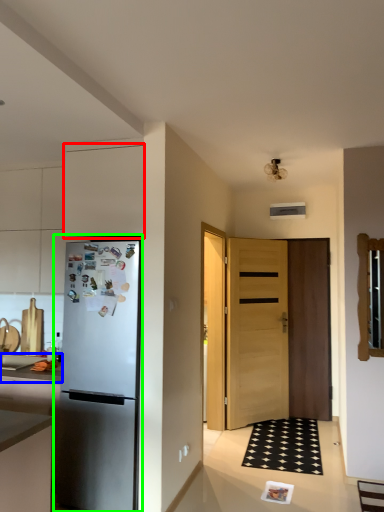
Question: Based on their relative distances, which object is farther from cabinetry (highlighted by a red box)? Choose from countertop (highlighted by a blue box) and refrigerator (highlighted by a green box).

Choices:
 (A) countertop
 (B) refrigerator

Answer: (A)